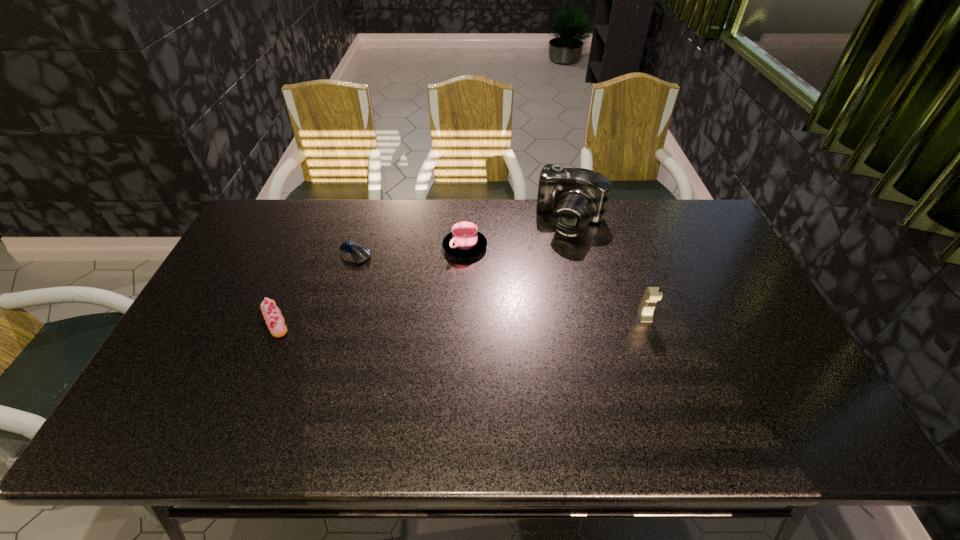
This screenshot has height=540, width=960. I want to click on empty space that is in between the cellular telephone and the fourth tallest object, so click(x=460, y=319).

Locate an element on the screen. The width and height of the screenshot is (960, 540). vacant area that lies between the cellular telephone and the leftmost object is located at coordinates (460, 319).

Locate an element on the screen. The height and width of the screenshot is (540, 960). free space between the leftmost object and the cellular telephone is located at coordinates pyautogui.click(x=460, y=319).

Find the location of a particular element. unoccupied area between the third object from right to left and the camera is located at coordinates (518, 233).

Where is `free space between the fourth object from left to right and the third object from left to right`? The height and width of the screenshot is (540, 960). free space between the fourth object from left to right and the third object from left to right is located at coordinates (518, 233).

Where is `unoccupied position between the cellular telephone and the computer mouse`? The image size is (960, 540). unoccupied position between the cellular telephone and the computer mouse is located at coordinates (499, 286).

Image resolution: width=960 pixels, height=540 pixels. Identify the location of free space between the third object from left to right and the rightmost object. (555, 282).

I want to click on free space between the second shortest object and the camera, so click(x=422, y=270).

Select which object appears as the second closest to the rightmost object. Please provide its 2D coordinates. Your answer should be formatted as a tuple, i.e. [(x, y)], where the tuple contains the x and y coordinates of a point satisfying the conditions above.

[(464, 241)]

Where is `the third closest object relative to the third tallest object`? This screenshot has width=960, height=540. the third closest object relative to the third tallest object is located at coordinates (275, 321).